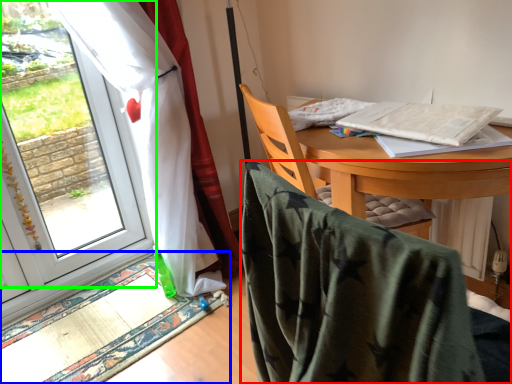
Question: Which object is the farthest from chair (highlighted by a red box)? Choose among these: mat (highlighted by a blue box) or window (highlighted by a green box).

Choices:
 (A) mat
 (B) window

Answer: (B)